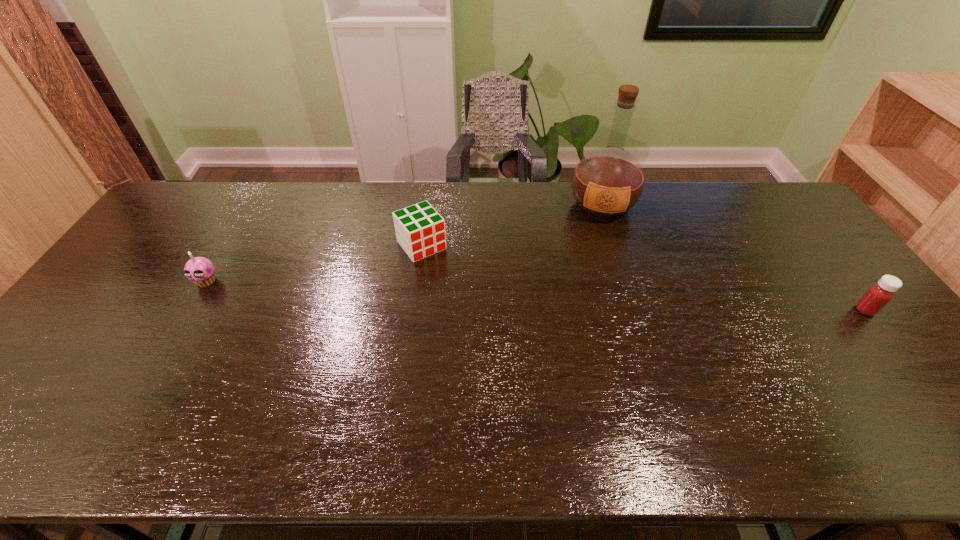
The image size is (960, 540). In order to click on vacant area between the rightmost object and the third object from left to right in this screenshot , I will do `click(733, 258)`.

Identify which object is located as the third nearest to the rightmost object. Please provide its 2D coordinates. Your answer should be formatted as a tuple, i.e. [(x, y)], where the tuple contains the x and y coordinates of a point satisfying the conditions above.

[(200, 270)]

Select which object appears as the third closest to the nearest object. Please provide its 2D coordinates. Your answer should be formatted as a tuple, i.e. [(x, y)], where the tuple contains the x and y coordinates of a point satisfying the conditions above.

[(200, 270)]

Identify the location of free space in the image that satisfies the following two spatial constraints: 1. on the face of the nearest object; 2. on the left side of the second nearest object. (189, 310).

The width and height of the screenshot is (960, 540). I want to click on free spot that satisfies the following two spatial constraints: 1. on the face of the cupcake; 2. on the left side of the rightmost object, so click(189, 310).

Where is `free space that satisfies the following two spatial constraints: 1. on the face of the medicine; 2. on the left side of the cupcake`? free space that satisfies the following two spatial constraints: 1. on the face of the medicine; 2. on the left side of the cupcake is located at coordinates (189, 310).

At what (x,y) coordinates should I click in order to perform the action: click on vacant space that satisfies the following two spatial constraints: 1. on the front side of the nearest object; 2. on the right side of the liquor. Please return your answer as a coordinate pair (x, y). The height and width of the screenshot is (540, 960). Looking at the image, I should click on (635, 310).

Where is `free spot that satisfies the following two spatial constraints: 1. on the face of the third farthest object; 2. on the right side of the medicine`? free spot that satisfies the following two spatial constraints: 1. on the face of the third farthest object; 2. on the right side of the medicine is located at coordinates (189, 310).